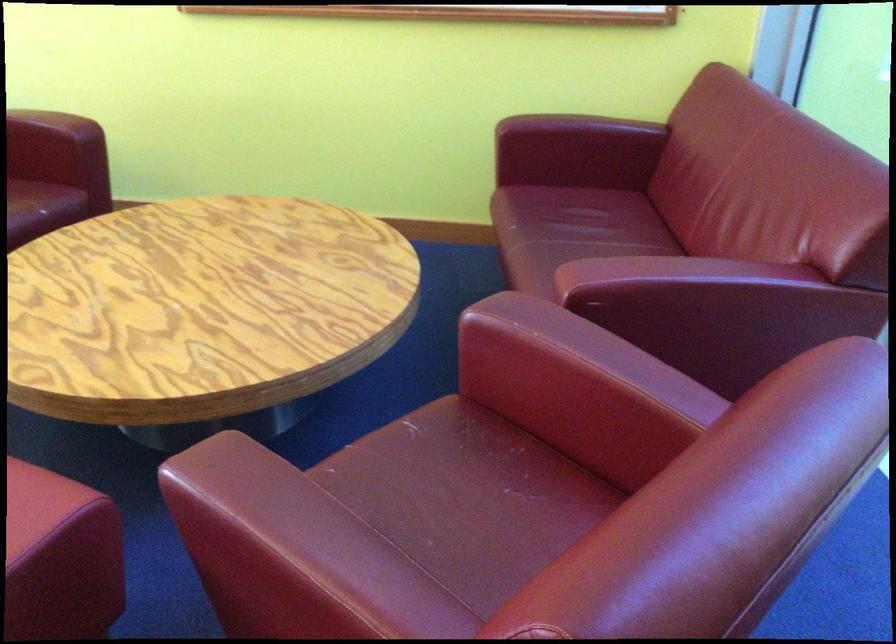
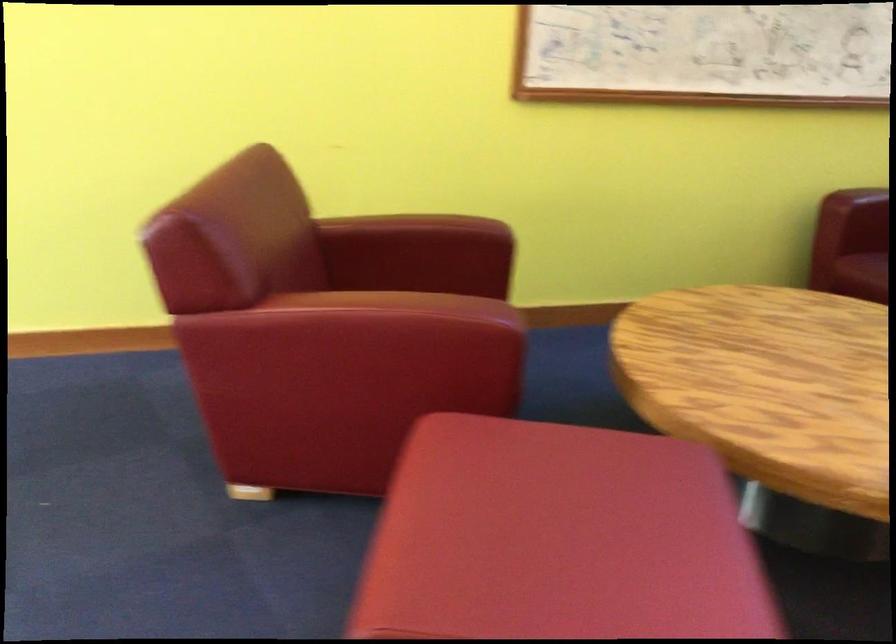
Question: Which direction would the cameraman need to move to produce the second image? Reply with the corresponding letter.

Choices:
 (A) Left
 (B) Right
 (C) Forward
 (D) Backward

Answer: (A)